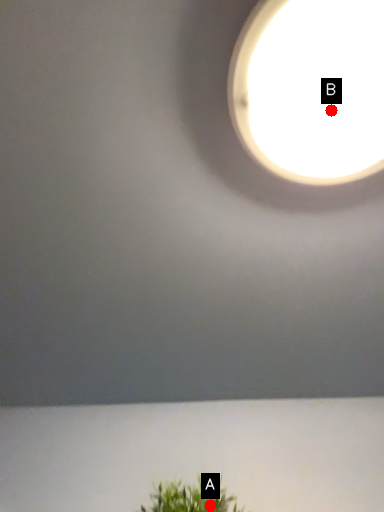
Question: Two points are circled on the image, labeled by A and B beside each circle. Which point is closer to the camera?

Choices:
 (A) A is closer
 (B) B is closer

Answer: (B)